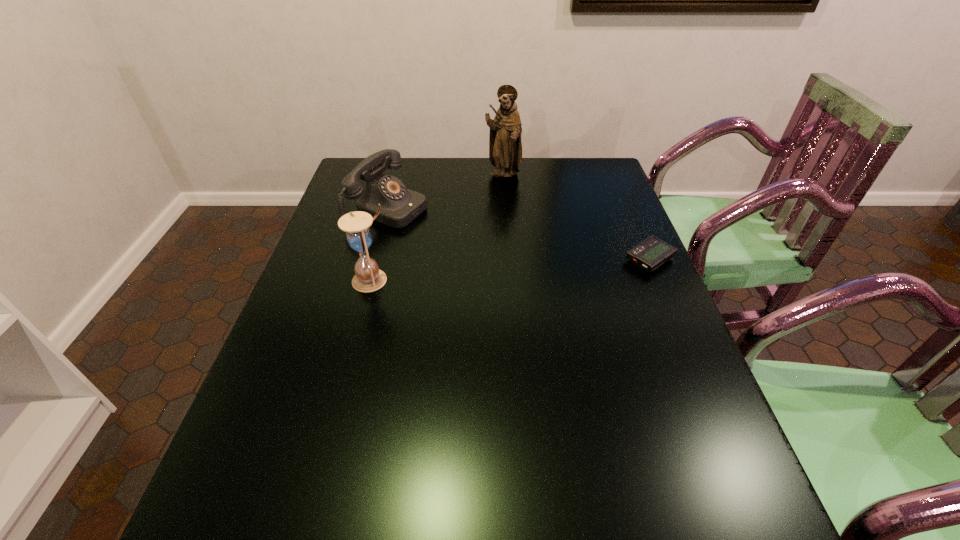
The image size is (960, 540). I want to click on object that is at the far left corner, so click(399, 206).

Locate an element on the screen. Image resolution: width=960 pixels, height=540 pixels. vacant space at the far edge of the desktop is located at coordinates (424, 159).

Where is `blank space at the near edge of the desktop`? The height and width of the screenshot is (540, 960). blank space at the near edge of the desktop is located at coordinates (493, 447).

Image resolution: width=960 pixels, height=540 pixels. In the image, there is a desktop. In order to click on free space at the left edge in this screenshot , I will do `click(281, 414)`.

I want to click on vacant space at the right edge, so click(x=687, y=350).

Locate an element on the screen. This screenshot has height=540, width=960. vacant space at the near left corner of the desktop is located at coordinates (313, 463).

This screenshot has width=960, height=540. What are the coordinates of `free area in between the hourglass and the farthest object` in the screenshot? It's located at (437, 228).

Identify the location of vacant area between the third tallest object and the second object from right to left. The width and height of the screenshot is (960, 540). (445, 192).

The width and height of the screenshot is (960, 540). What are the coordinates of `vacant space in between the third nearest object and the beeper` in the screenshot? It's located at (519, 234).

Find the location of `free space between the second tallest object and the tallest object`. free space between the second tallest object and the tallest object is located at coordinates tap(437, 228).